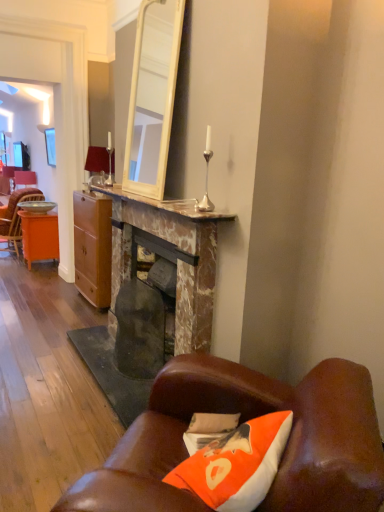
This screenshot has height=512, width=384. In order to click on matte silver lamp at upper left in this screenshot , I will do `click(100, 162)`.

The width and height of the screenshot is (384, 512). In order to click on matte wood cabinet at center in this screenshot , I will do `click(93, 247)`.

What do you see at coordinates (15, 216) in the screenshot? I see `orange wood chair at left, the second chair when ordered from back to front` at bounding box center [15, 216].

What do you see at coordinates (208, 429) in the screenshot? The height and width of the screenshot is (512, 384). I see `orange fabric pillow at lower right` at bounding box center [208, 429].

The height and width of the screenshot is (512, 384). What are the coordinates of `matte silver lamp at upper left` in the screenshot? It's located at (100, 162).

From a real-world perspective, is orange wood desk at left physically located above or below matte silver lamp at upper left?

In terms of real-world spatial position, orange wood desk at left is below matte silver lamp at upper left.

Is orange wood desk at left not close to matte silver lamp at upper left?

orange wood desk at left is positioned a significant distance from matte silver lamp at upper left.

From the image's perspective, is orange wood desk at left below matte silver lamp at upper left?

Yes, from the image's perspective, orange wood desk at left is beneath matte silver lamp at upper left.

Considering the relative sizes of marble fireplace at center and leather couch at lower right in the image provided, is marble fireplace at center wider than leather couch at lower right?

No, marble fireplace at center is not wider than leather couch at lower right.

Is marble fireplace at center with leather couch at lower right?

They are not placed beside each other.

Measure the distance between marble fireplace at center and leather couch at lower right.

marble fireplace at center and leather couch at lower right are 3.49 feet apart.

I want to click on mantle that is above the leather couch at lower right (from the image's perspective), so click(x=165, y=205).

Can you confirm if orange wood desk at left is smaller than matte orange cushion at lower left, the second chair positioned from the front?

No, orange wood desk at left is not smaller than matte orange cushion at lower left, the second chair positioned from the front.

Can you confirm if orange wood desk at left is thinner than matte orange cushion at lower left, marked as the 1th chair in a top-to-bottom arrangement?

Incorrect, the width of orange wood desk at left is not less than that of matte orange cushion at lower left, marked as the 1th chair in a top-to-bottom arrangement.

From the image's perspective, is orange wood desk at left over matte orange cushion at lower left, the 2th chair ordered from the bottom?

Actually, orange wood desk at left appears below matte orange cushion at lower left, the 2th chair ordered from the bottom, in the image.

Which object is positioned more to the left, orange wood desk at left or matte orange cushion at lower left, the second chair positioned from the front?

matte orange cushion at lower left, the second chair positioned from the front, is more to the left.

How distant is orange fabric pillow at lower right from marble fireplace at center?

orange fabric pillow at lower right and marble fireplace at center are 3.93 feet apart from each other.

Visually, is orange fabric pillow at lower right positioned to the left or to the right of marble fireplace at center?

In the image, orange fabric pillow at lower right appears on the right side of marble fireplace at center.

Considering the sizes of objects orange fabric pillow at lower right and marble fireplace at center in the image provided, who is bigger, orange fabric pillow at lower right or marble fireplace at center?

Bigger between the two is marble fireplace at center.

Is orange fabric pillow at lower right in front of marble fireplace at center?

Yes, the depth of orange fabric pillow at lower right is less than that of marble fireplace at center.

From the image's perspective, relative to orange fabric pillow at lower right, is matte orange cushion at lower left, the 1th chair from the back, above or below?

matte orange cushion at lower left, the 1th chair from the back, is above orange fabric pillow at lower right.

Between matte orange cushion at lower left, marked as the 1th chair in a top-to-bottom arrangement, and orange fabric pillow at lower right, which one is positioned behind?

matte orange cushion at lower left, marked as the 1th chair in a top-to-bottom arrangement, is behind.

How far apart are matte orange cushion at lower left, the second chair positioned from the front, and orange fabric pillow at lower right?

They are 6.07 meters apart.

How different are the orientations of matte orange cushion at lower left, the 1th chair from the back, and orange fabric pillow at lower right in degrees?

The facing directions of matte orange cushion at lower left, the 1th chair from the back, and orange fabric pillow at lower right are 11.4 degrees apart.

Is matte silver lamp at upper left inside or outside of marble fireplace at center?

matte silver lamp at upper left is not enclosed by marble fireplace at center.

How far apart are matte silver lamp at upper left and marble fireplace at center?

matte silver lamp at upper left is 1.12 meters away from marble fireplace at center.

From the picture: From a real-world perspective, is matte silver lamp at upper left under marble fireplace at center?

No, from a real-world perspective, matte silver lamp at upper left is not beneath marble fireplace at center.

In the scene shown: From the image's perspective, is marble fireplace at center positioned above or below orange fabric pillow at lower right?

Based on their image positions, marble fireplace at center is located above orange fabric pillow at lower right.

Does marble fireplace at center contain orange fabric pillow at lower right?

No, orange fabric pillow at lower right is not surrounded by marble fireplace at center.

Based on the photo, considering the positions of objects marble fireplace at center and orange fabric pillow at lower right in the image provided, who is more to the left, marble fireplace at center or orange fabric pillow at lower right?

Positioned to the left is marble fireplace at center.

Between marble fireplace at center and orange fabric pillow at lower right, which one has less height?

marble fireplace at center is shorter.

This screenshot has width=384, height=512. What are the coordinates of `desk located behind the matte silver lamp at upper left` in the screenshot? It's located at (39, 236).

In the image, there is a leather couch at lower right. At what (x,y) coordinates should I click in order to perform the action: click on mantle above it (from the image's perspective). Please return your answer as a coordinate pair (x, y). Image resolution: width=384 pixels, height=512 pixels. Looking at the image, I should click on (165, 205).

Which object lies nearer to the anchor point marble fireplace at center, matte orange cushion at lower left, marked as the 1th chair in a top-to-bottom arrangement, or orange wood desk at left?

Based on the image, orange wood desk at left appears to be nearer to marble fireplace at center.

From the image, which object appears to be nearer to marble fireplace at center, matte orange cushion at lower left, the second chair positioned from the front, or orange fabric pillow at lower right?

orange fabric pillow at lower right is closer to marble fireplace at center.

From the picture: From the image, which object appears to be nearer to leather couch at lower right, orange fabric pillow at lower right or matte wood cabinet at center?

Based on the image, orange fabric pillow at lower right appears to be nearer to leather couch at lower right.

Estimate the real-world distances between objects in this image. Which object is closer to matte wood cabinet at center, marble fireplace at center or matte silver lamp at upper left?

The object closer to matte wood cabinet at center is matte silver lamp at upper left.

Looking at the image, which one is located further to orange fabric pillow at lower right, leather couch at lower right or marble fireplace at center?

marble fireplace at center is positioned further to the anchor orange fabric pillow at lower right.

Considering their positions, is leather couch at lower right positioned closer to orange fabric pillow at lower right than marble fireplace at center?

Based on the image, leather couch at lower right appears to be nearer to orange fabric pillow at lower right.

Which object lies nearer to the anchor point matte wood cabinet at center, marble fireplace at center or orange wood chair at left, placed as the 1th chair when sorted from front to back?

marble fireplace at center.

Based on the photo, considering their positions, is marble fireplace at center positioned further to marble fireplace at center than matte orange cushion at lower left, the 1th chair from the back?

matte orange cushion at lower left, the 1th chair from the back, is further to marble fireplace at center.

You are a GUI agent. You are given a task and a screenshot of the screen. Output one action in this format:
    pyautogui.click(x=<x>, y=<y>)
    Task: Click on the desk between matte wood cabinet at center and matte orange cushion at lower left, marked as the 1th chair in a top-to-bottom arrangement, from front to back
    
    Given the screenshot: What is the action you would take?
    point(39,236)

The image size is (384, 512). Identify the location of lamp between marble fireplace at center and orange wood desk at left from front to back. (100, 162).

Image resolution: width=384 pixels, height=512 pixels. Identify the location of cabinetry between marble fireplace at center and matte silver lamp at upper left in the front-back direction. (93, 247).

I want to click on lamp positioned between marble fireplace at center and matte orange cushion at lower left, marked as the 1th chair in a top-to-bottom arrangement, from near to far, so click(x=100, y=162).